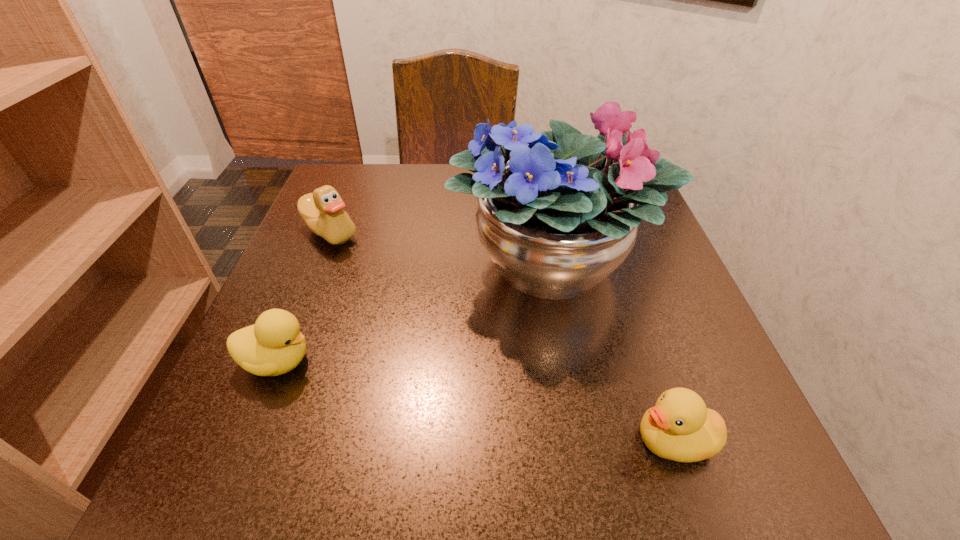
You are a GUI agent. You are given a task and a screenshot of the screen. Output one action in this format:
    pyautogui.click(x=<x>, y=<y>)
    Task: Click on the tallest object
    Image resolution: width=960 pixels, height=540 pixels.
    Given the screenshot: What is the action you would take?
    pyautogui.click(x=556, y=219)

Where is `the farthest duck`? the farthest duck is located at coordinates (322, 211).

Find the location of `the second nearest object`. the second nearest object is located at coordinates (274, 345).

At what (x,y) coordinates should I click in order to perform the action: click on the nearest duck. Please return your answer as a coordinate pair (x, y). The image size is (960, 540). Looking at the image, I should click on (679, 427).

At what (x,y) coordinates should I click in order to perform the action: click on the rightmost duck. Please return your answer as a coordinate pair (x, y). The image size is (960, 540). Looking at the image, I should click on (679, 427).

Where is `free location located on the left of the bouquet`? This screenshot has width=960, height=540. free location located on the left of the bouquet is located at coordinates (321, 264).

At what (x,y) coordinates should I click in order to perform the action: click on vacant space located at the beak of the farthest duck. Please return your answer as a coordinate pair (x, y). Looking at the image, I should click on click(x=291, y=328).

The image size is (960, 540). Find the location of `vacant area situated on the front-facing side of the second nearest duck`. vacant area situated on the front-facing side of the second nearest duck is located at coordinates (497, 361).

Find the location of a particular element. vacant space located at the beak of the nearest object is located at coordinates (369, 440).

Image resolution: width=960 pixels, height=540 pixels. In order to click on vacant region located 0.170m at the beak of the nearest object in this screenshot , I will do `click(504, 440)`.